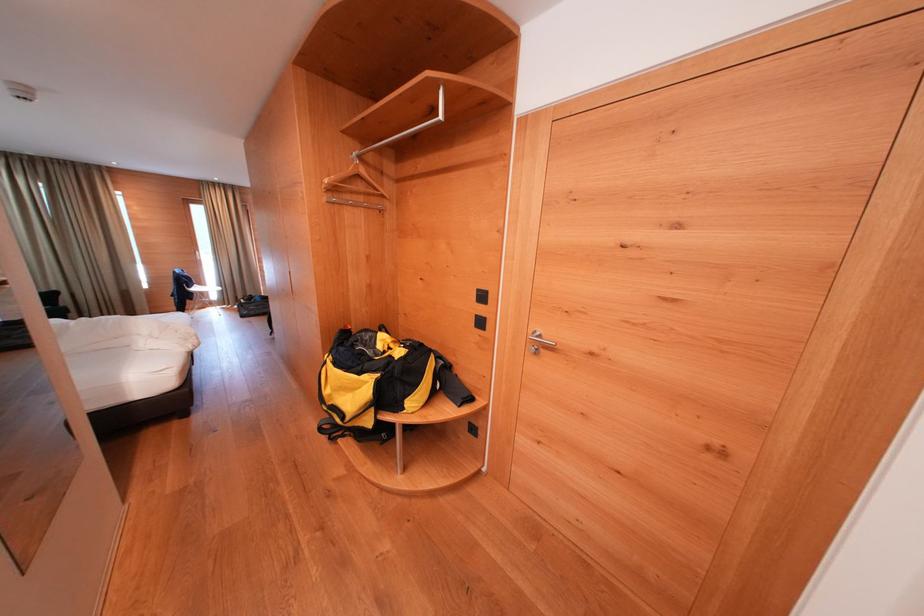
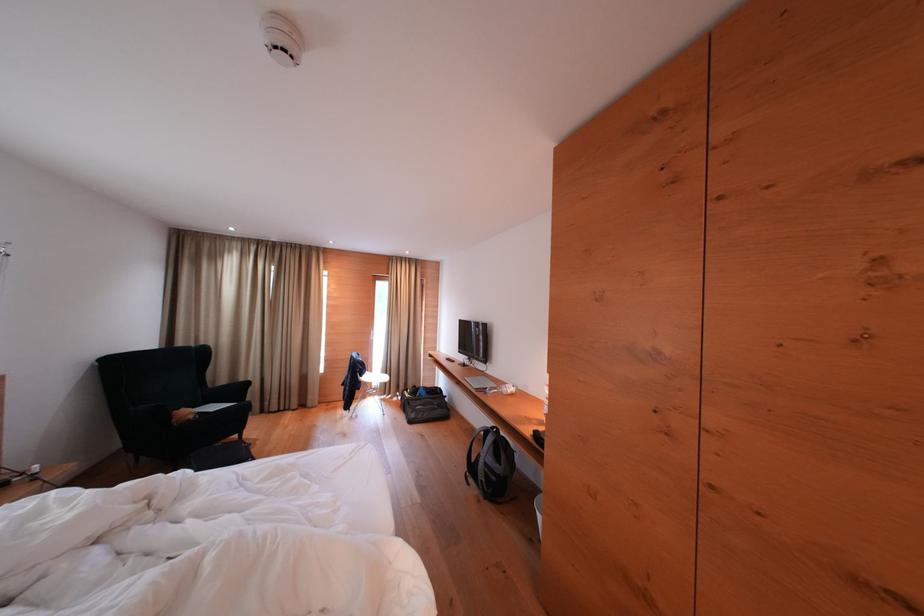
Consider the image. In a continuous first-person perspective shot, in which direction is the camera moving?

The movement direction of the cameraman is left, forward.